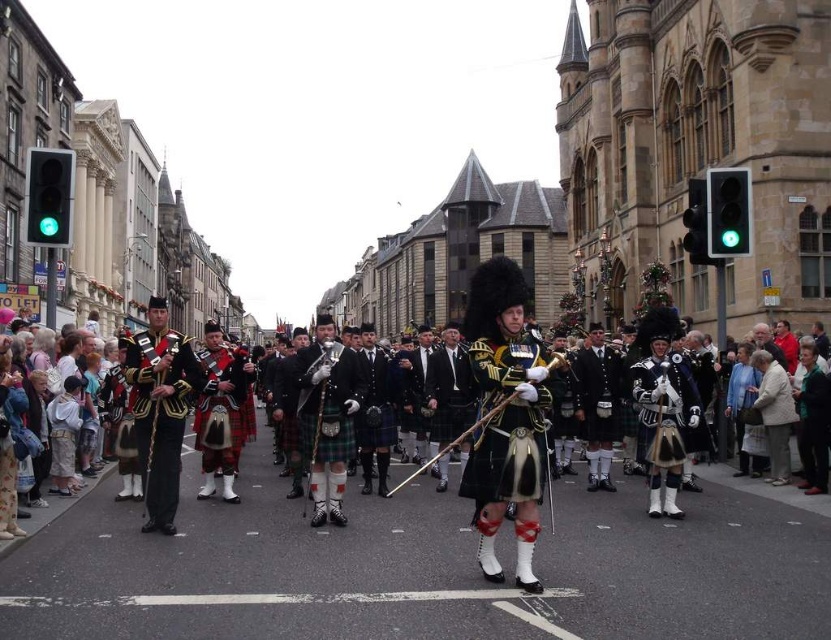
Question: Does shiny gold uniform at center appear over green glass traffic light at left?

Choices:
 (A) no
 (B) yes

Answer: (A)

Question: In this image, where is green glass traffic light at left located relative to green glass traffic light at upper right?

Choices:
 (A) above
 (B) below

Answer: (A)

Question: Which point is farther to the camera?

Choices:
 (A) green glass traffic light at right
 (B) shiny gold uniform at center
 (C) green glass traffic light at left

Answer: (A)

Question: Which object appears closest to the camera in this image?

Choices:
 (A) green glass traffic light at right
 (B) matte black kilt at center
 (C) green glass traffic light at left
 (D) shiny black kilt at center

Answer: (D)

Question: Is matte black kilt at center to the right of green glass traffic light at upper right from the viewer's perspective?

Choices:
 (A) yes
 (B) no

Answer: (B)

Question: Which object is farther from the camera taking this photo?

Choices:
 (A) green glass traffic light at left
 (B) green glass traffic light at right
 (C) shiny black kilt at center
 (D) green glass traffic light at upper right

Answer: (D)